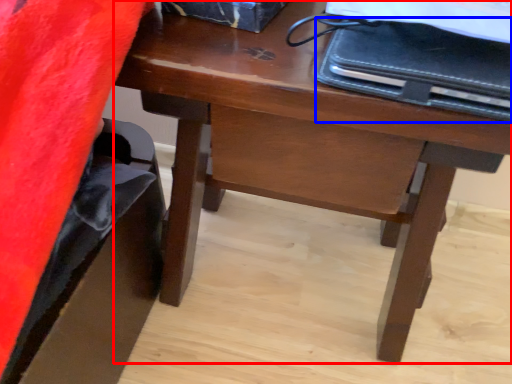
Question: Among these objects, which one is nearest to the camera, desk (highlighted by a red box) or notebook (highlighted by a blue box)?

Choices:
 (A) desk
 (B) notebook

Answer: (B)